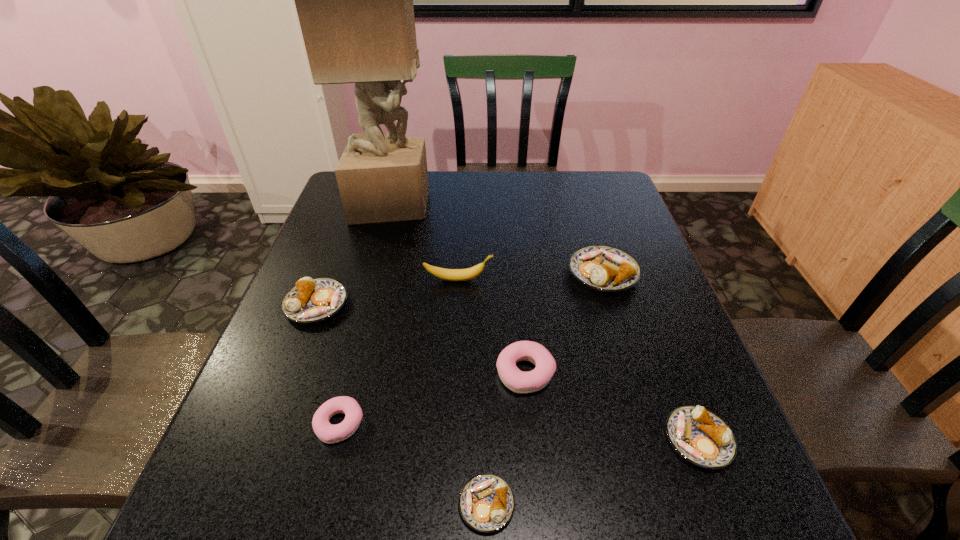
Image resolution: width=960 pixels, height=540 pixels. Identify the location of the second smallest brown pastry. (698, 435).

The width and height of the screenshot is (960, 540). Identify the location of the nearer pink pastry. (326, 432).

Where is `the left pink pastry`? the left pink pastry is located at coordinates (326, 432).

Where is `the nearest brown pastry`? the nearest brown pastry is located at coordinates (486, 502).

Where is `the nearest object`? This screenshot has height=540, width=960. the nearest object is located at coordinates (486, 502).

Find the location of a particular element. free space located 0.330m on the front-facing side of the farthest object is located at coordinates (537, 204).

Find the location of a particular element. The image size is (960, 540). free location located at the stem of the banana is located at coordinates (636, 279).

At what (x,y) coordinates should I click in order to perform the action: click on free space located on the front of the tallest pastry. Please return your answer as a coordinate pair (x, y). Looking at the image, I should click on (634, 369).

The image size is (960, 540). In order to click on free space located on the back of the leftmost brown pastry in this screenshot , I will do `click(344, 233)`.

You are a GUI agent. You are given a task and a screenshot of the screen. Output one action in this format:
    pyautogui.click(x=<x>, y=<y>)
    Task: Click on the vacant space located 0.190m on the back of the right pink pastry
    
    Given the screenshot: What is the action you would take?
    pyautogui.click(x=517, y=289)